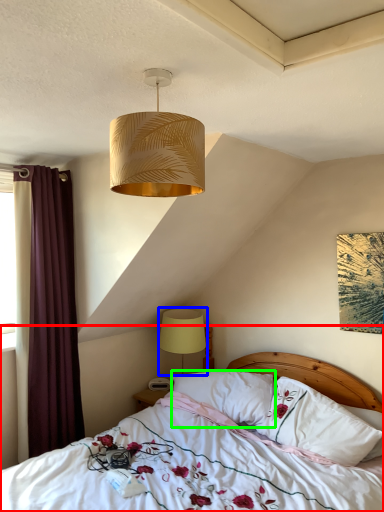
Question: Which object is positioned closest to bed (highlighted by a red box)? Select from lamp (highlighted by a blue box) and pillow (highlighted by a green box).

Choices:
 (A) lamp
 (B) pillow

Answer: (B)